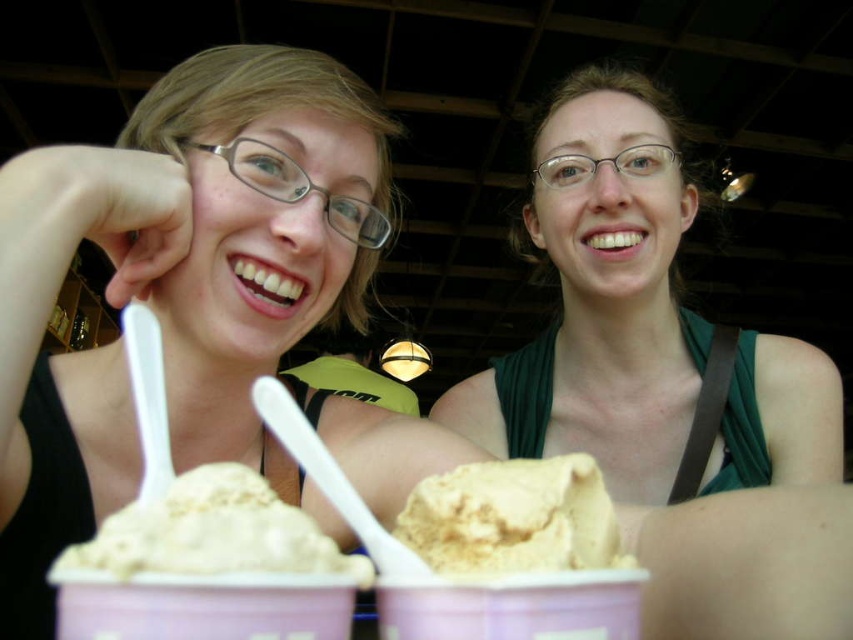
Does matte plastic spoon at upper center appear over green matte tank top at center?

Actually, matte plastic spoon at upper center is below green matte tank top at center.

Image resolution: width=853 pixels, height=640 pixels. Describe the element at coordinates (178, 285) in the screenshot. I see `matte plastic spoon at upper center` at that location.

At what (x,y) coordinates should I click in order to perform the action: click on matte plastic spoon at upper center. Please return your answer as a coordinate pair (x, y). This screenshot has height=640, width=853. Looking at the image, I should click on (178, 285).

Image resolution: width=853 pixels, height=640 pixels. What do you see at coordinates (178, 285) in the screenshot?
I see `matte plastic spoon at upper center` at bounding box center [178, 285].

Is point (384, 161) positioned in front of point (225, 506)?

No, (384, 161) is further to viewer.

Find the location of a particular element. matte plastic spoon at upper center is located at coordinates (178, 285).

Can you confirm if green matte tank top at center is thinner than vanilla ice cream at lower center?

Incorrect, green matte tank top at center's width is not less than vanilla ice cream at lower center's.

Is point (769, 403) positioned in front of point (165, 500)?

No, (769, 403) is further to viewer.

Is point (805, 449) closer to camera compared to point (138, 536)?

No, (805, 449) is behind (138, 536).

In order to click on green matte tank top at center in this screenshot , I will do `click(640, 324)`.